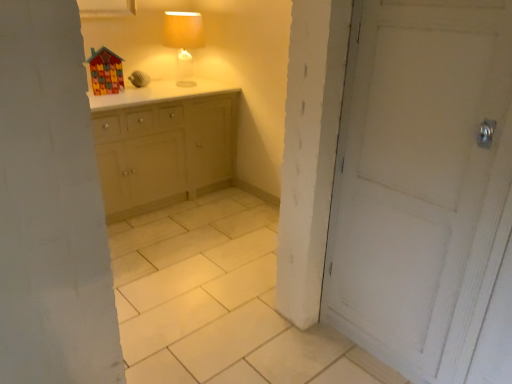
Question: Can you confirm if matte yellow fabric lampshade at upper center is shorter than white matte door at right?

Choices:
 (A) yes
 (B) no

Answer: (A)

Question: Is matte yellow fabric lampshade at upper center outside white matte door at right?

Choices:
 (A) yes
 (B) no

Answer: (A)

Question: Is matte yellow fabric lampshade at upper center to the right of white matte door at right from the viewer's perspective?

Choices:
 (A) yes
 (B) no

Answer: (B)

Question: Is matte yellow fabric lampshade at upper center wider than white matte door at right?

Choices:
 (A) yes
 (B) no

Answer: (B)

Question: Considering the relative sizes of matte yellow fabric lampshade at upper center and white matte door at right in the image provided, is matte yellow fabric lampshade at upper center smaller than white matte door at right?

Choices:
 (A) yes
 (B) no

Answer: (A)

Question: Are matte yellow fabric lampshade at upper center and white matte door at right making contact?

Choices:
 (A) yes
 (B) no

Answer: (B)

Question: Is white matte door at right not near matte yellow fabric lampshade at upper center?

Choices:
 (A) no
 (B) yes

Answer: (B)

Question: Is white matte door at right bigger than matte yellow fabric lampshade at upper center?

Choices:
 (A) yes
 (B) no

Answer: (A)

Question: Considering the relative sizes of white matte door at right and matte yellow fabric lampshade at upper center in the image provided, is white matte door at right wider than matte yellow fabric lampshade at upper center?

Choices:
 (A) no
 (B) yes

Answer: (B)

Question: From a real-world perspective, does white matte door at right sit lower than matte yellow fabric lampshade at upper center?

Choices:
 (A) no
 (B) yes

Answer: (B)

Question: Can you confirm if white matte door at right is smaller than matte yellow fabric lampshade at upper center?

Choices:
 (A) no
 (B) yes

Answer: (A)

Question: Considering the relative positions of white matte door at right and matte yellow fabric lampshade at upper center in the image provided, is white matte door at right in front of matte yellow fabric lampshade at upper center?

Choices:
 (A) yes
 (B) no

Answer: (A)

Question: Looking at the image, does matte yellow fabric lampshade at upper center seem bigger or smaller compared to white matte door at right?

Choices:
 (A) small
 (B) big

Answer: (A)